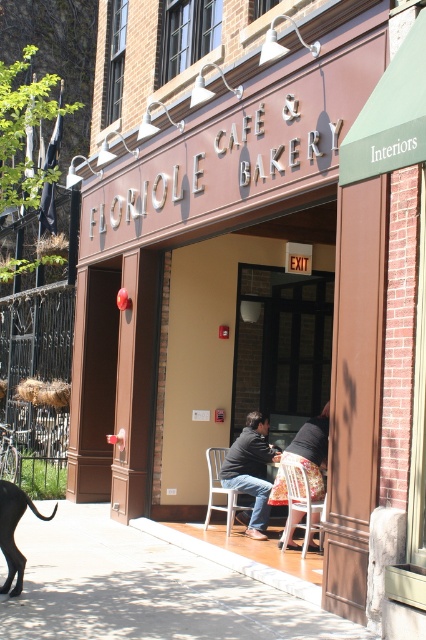
Can you confirm if smooth concrete pavement at center is positioned to the right of wooden at center?

No, smooth concrete pavement at center is not to the right of wooden at center.

Who is more distant from viewer, (x=134, y=573) or (x=307, y=520)?

The point (x=307, y=520) is more distant.

Based on the photo, who is more distant from viewer, (213, 602) or (305, 488)?

The point (305, 488) is behind.

Identify the location of smooth concrete pavement at center. (143, 589).

Which of these two, dark gray sweater at center or wooden at center, stands taller?

Standing taller between the two is dark gray sweater at center.

What do you see at coordinates (250, 468) in the screenshot?
I see `dark gray sweater at center` at bounding box center [250, 468].

Find the location of a particular element. This screenshot has height=640, width=426. dark gray sweater at center is located at coordinates (250, 468).

Who is more distant from viewer, (120, 540) or (261, 492)?

Point (261, 492)

Who is shorter, smooth concrete pavement at center or dark gray sweater at center?

With less height is smooth concrete pavement at center.

Locate an element on the screen. The image size is (426, 640). smooth concrete pavement at center is located at coordinates (143, 589).

Identify the location of smooth concrete pavement at center. (143, 589).